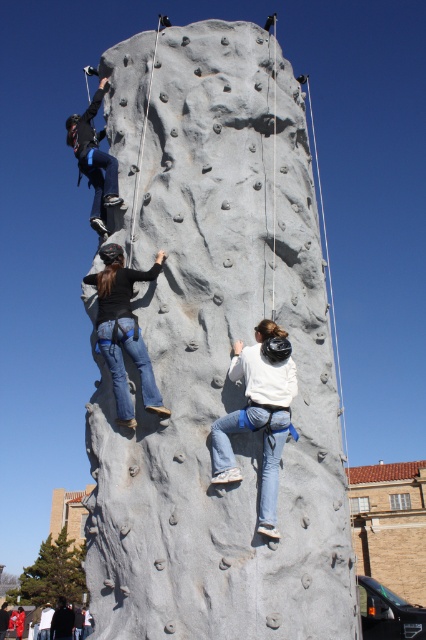
Question: Estimate the real-world distances between objects in this image. Which object is closer to the smooth concrete rock climbing at center?

Choices:
 (A) matte blue pants at upper left
 (B) matte black helmet at center

Answer: (B)

Question: Which of these objects is positioned closest to the matte black helmet at center?

Choices:
 (A) smooth concrete rock climbing at center
 (B) matte blue pants at upper left

Answer: (A)

Question: Is smooth concrete rock climbing at center below matte black helmet at center?

Choices:
 (A) yes
 (B) no

Answer: (B)

Question: Which is nearer to the smooth concrete rock climbing at center?

Choices:
 (A) matte black helmet at center
 (B) matte blue pants at upper left

Answer: (A)

Question: In this image, where is matte black helmet at center located relative to matte blue pants at upper left?

Choices:
 (A) left
 (B) right

Answer: (B)

Question: Does smooth concrete rock climbing at center appear on the left side of matte blue pants at upper left?

Choices:
 (A) no
 (B) yes

Answer: (A)